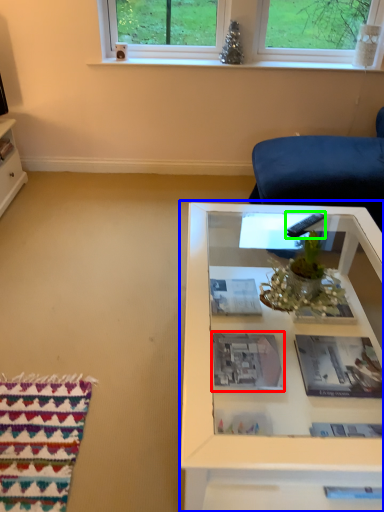
Question: Considering the real-world distances, which object is closest to book (highlighted by a red box)? table (highlighted by a blue box) or remote (highlighted by a green box).

Choices:
 (A) table
 (B) remote

Answer: (A)